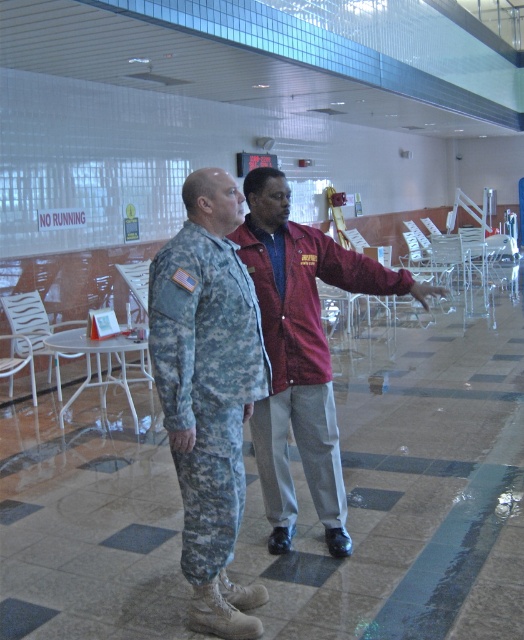
You are a lifeguard at the indoor pool and need to retrieve an object. The maroon fabric jacket at center and the white plastic chair at left are in your line of sight. Which object is closer to your position if you are standing at the pool edge where the NO RUNNING sign is located?

The white plastic chair at left is closer to your position because it is positioned to the left of the maroon fabric jacket at center, which is further away.